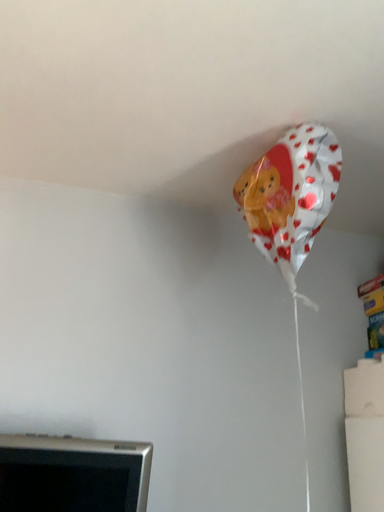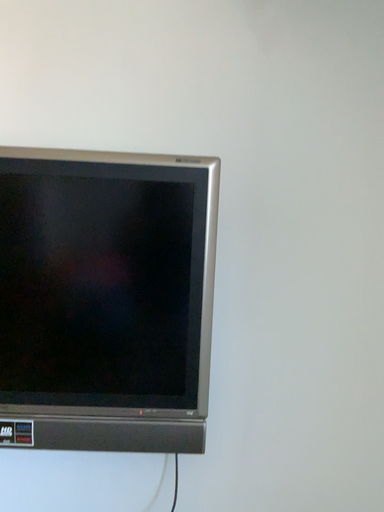
Question: Which way did the camera rotate in the video?

Choices:
 (A) rotated downward
 (B) rotated upward

Answer: (A)